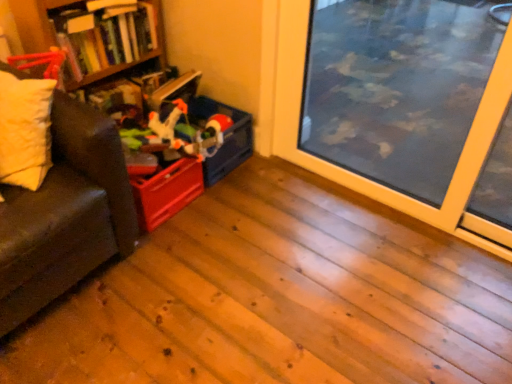
Where is `matte plastic storage box at center-left`? The width and height of the screenshot is (512, 384). matte plastic storage box at center-left is located at coordinates (224, 137).

You are a GUI agent. You are given a task and a screenshot of the screen. Output one action in this format:
    pyautogui.click(x=<x>, y=<y>)
    Task: Click on the soft yellow pillow at left
    The height and width of the screenshot is (384, 512).
    Given the screenshot: What is the action you would take?
    pyautogui.click(x=25, y=130)

The width and height of the screenshot is (512, 384). Identify the location of matte plastic storage box at center-left. (224, 137).

From a real-world perspective, is soft yellow pillow at left located beneath transparent glass window screen at center right?

No, from a real-world perspective, soft yellow pillow at left is not under transparent glass window screen at center right.

Is soft yellow pillow at left not inside transparent glass window screen at center right?

Indeed, soft yellow pillow at left is completely outside transparent glass window screen at center right.

How many degrees apart are the facing directions of soft yellow pillow at left and transparent glass window screen at center right?

There is a 19.2-degree angle between the facing directions of soft yellow pillow at left and transparent glass window screen at center right.

At what (x,y) coordinates should I click in order to perform the action: click on window screen behind the soft yellow pillow at left. Please return your answer as a coordinate pair (x, y). The height and width of the screenshot is (384, 512). Looking at the image, I should click on (397, 87).

Considering the relative sizes of wooden bookshelf at upper left and transparent glass window screen at center right in the image provided, is wooden bookshelf at upper left taller than transparent glass window screen at center right?

Incorrect, the height of wooden bookshelf at upper left is not larger of that of transparent glass window screen at center right.

Could you tell me if wooden bookshelf at upper left is facing transparent glass window screen at center right?

Yes, wooden bookshelf at upper left is turned towards transparent glass window screen at center right.

Is point (83, 94) less distant than point (322, 29)?

Yes, it is in front of point (322, 29).

From the image's perspective, is wooden bookshelf at upper left located beneath transparent glass window screen at center right?

Incorrect, from the image's perspective, wooden bookshelf at upper left is higher than transparent glass window screen at center right.

Is matte plastic storage box at center-left taller than soft yellow pillow at left?

No, matte plastic storage box at center-left is not taller than soft yellow pillow at left.

Is matte plastic storage box at center-left bigger or smaller than soft yellow pillow at left?

Considering their sizes, matte plastic storage box at center-left takes up more space than soft yellow pillow at left.

Between matte plastic storage box at center-left and soft yellow pillow at left, which one appears on the left side from the viewer's perspective?

From the viewer's perspective, soft yellow pillow at left appears more on the left side.

Find the location of a particular element. pillow on the left of matte plastic storage box at center-left is located at coordinates (25, 130).

Are matte plastic storage box at center-left and wooden bookshelf at upper left making contact?

There is a gap between matte plastic storage box at center-left and wooden bookshelf at upper left.

Find the location of a particular element. The width and height of the screenshot is (512, 384). storage box below the wooden bookshelf at upper left (from a real-world perspective) is located at coordinates tap(224, 137).

From the picture: Is matte plastic storage box at center-left in front of or behind wooden bookshelf at upper left in the image?

In the image, matte plastic storage box at center-left appears behind wooden bookshelf at upper left.

Would you say matte plastic storage box at center-left contains wooden bookshelf at upper left?

No, wooden bookshelf at upper left is not surrounded by matte plastic storage box at center-left.

Is transparent glass window screen at center right turned away from matte plastic storage box at center-left?

No, transparent glass window screen at center right is not facing away from matte plastic storage box at center-left.

From the image's perspective, which object appears higher, transparent glass window screen at center right or matte plastic storage box at center-left?

transparent glass window screen at center right is shown above in the image.

Is transparent glass window screen at center right positioned far away from matte plastic storage box at center-left?

transparent glass window screen at center right is far away from matte plastic storage box at center-left.

Which point is more forward, (x=323, y=146) or (x=199, y=110)?

The point (x=199, y=110) is closer.

From the image's perspective, which is above, transparent glass window screen at center right or wooden bookshelf at upper left?

wooden bookshelf at upper left.

Can you confirm if transparent glass window screen at center right is positioned to the right of wooden bookshelf at upper left?

Yes.

Is transparent glass window screen at center right aimed at wooden bookshelf at upper left?

No, transparent glass window screen at center right does not turn towards wooden bookshelf at upper left.

Is soft yellow pillow at left positioned behind matte plastic storage box at center-left?

No, soft yellow pillow at left is in front of matte plastic storage box at center-left.

Between soft yellow pillow at left and matte plastic storage box at center-left, which one appears on the right side from the viewer's perspective?

Positioned to the right is matte plastic storage box at center-left.

Does point (11, 155) come behind point (237, 159)?

No, it is in front of (237, 159).

Is soft yellow pillow at left turned away from matte plastic storage box at center-left?

That's not correct — soft yellow pillow at left is not looking away from matte plastic storage box at center-left.

The image size is (512, 384). Identify the location of pillow on the left of transparent glass window screen at center right. (25, 130).

Locate an element on the screen. This screenshot has height=384, width=512. window screen that is below the wooden bookshelf at upper left (from the image's perspective) is located at coordinates (397, 87).

Estimate the real-world distances between objects in this image. Which object is further from matte plastic storage box at center-left, wooden bookshelf at upper left or transparent glass window screen at center right?

Among the two, transparent glass window screen at center right is located further to matte plastic storage box at center-left.

Looking at the image, which one is located closer to wooden bookshelf at upper left, matte plastic storage box at center-left or soft yellow pillow at left?

matte plastic storage box at center-left.

Looking at the image, which one is located further to transparent glass window screen at center right, wooden bookshelf at upper left or matte plastic storage box at center-left?

wooden bookshelf at upper left lies further to transparent glass window screen at center right than the other object.

Looking at the image, which one is located further to soft yellow pillow at left, wooden bookshelf at upper left or matte plastic storage box at center-left?

matte plastic storage box at center-left is positioned further to the anchor soft yellow pillow at left.

From the image, which object appears to be nearer to soft yellow pillow at left, matte plastic storage box at center-left or wooden bookshelf at upper left?

wooden bookshelf at upper left.

Based on their spatial positions, is matte plastic storage box at center-left or transparent glass window screen at center right further from soft yellow pillow at left?

Among the two, transparent glass window screen at center right is located further to soft yellow pillow at left.

Looking at the image, which one is located closer to transparent glass window screen at center right, matte plastic storage box at center-left or wooden bookshelf at upper left?

Based on the image, matte plastic storage box at center-left appears to be nearer to transparent glass window screen at center right.

Considering their positions, is transparent glass window screen at center right positioned closer to soft yellow pillow at left than matte plastic storage box at center-left?

The object closer to soft yellow pillow at left is matte plastic storage box at center-left.

Where is `bookshelf located between soft yellow pillow at left and matte plastic storage box at center-left in the depth direction`? The width and height of the screenshot is (512, 384). bookshelf located between soft yellow pillow at left and matte plastic storage box at center-left in the depth direction is located at coordinates (94, 38).

Where is `bookshelf situated between soft yellow pillow at left and transparent glass window screen at center right from left to right`? Image resolution: width=512 pixels, height=384 pixels. bookshelf situated between soft yellow pillow at left and transparent glass window screen at center right from left to right is located at coordinates (94, 38).

Locate an element on the screen. The height and width of the screenshot is (384, 512). storage box located between wooden bookshelf at upper left and transparent glass window screen at center right in the left-right direction is located at coordinates (224, 137).

Find the location of a particular element. The height and width of the screenshot is (384, 512). storage box between soft yellow pillow at left and transparent glass window screen at center right from left to right is located at coordinates (224, 137).